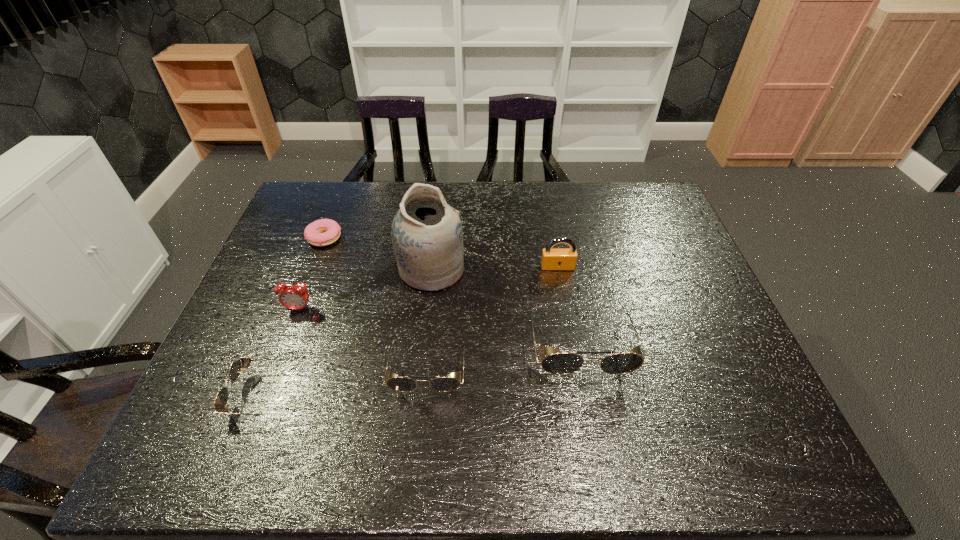
Where is `free space that satisfies the following two spatial constraints: 1. on the front lenses of the rightmost sunglasses; 2. on the front lenses of the shortest sunglasses`? free space that satisfies the following two spatial constraints: 1. on the front lenses of the rightmost sunglasses; 2. on the front lenses of the shortest sunglasses is located at coordinates (588, 395).